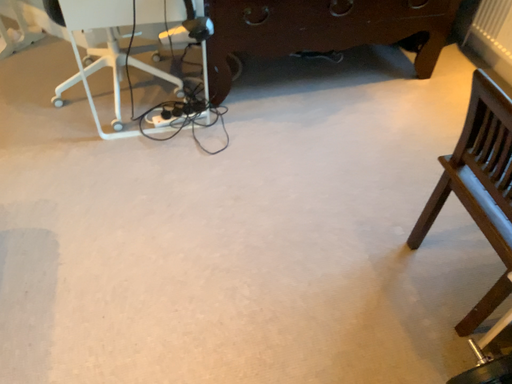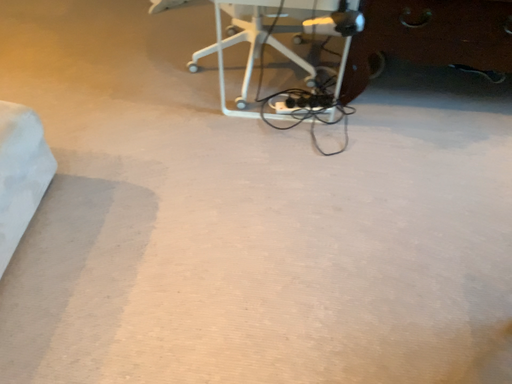
Question: Which way did the camera rotate in the video?

Choices:
 (A) rotated left
 (B) rotated right

Answer: (A)